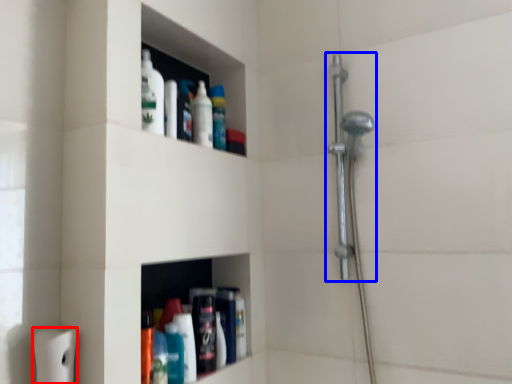
Question: Which object is further to the camera taking this photo, toilet paper (highlighted by a red box) or shower (highlighted by a blue box)?

Choices:
 (A) toilet paper
 (B) shower

Answer: (B)